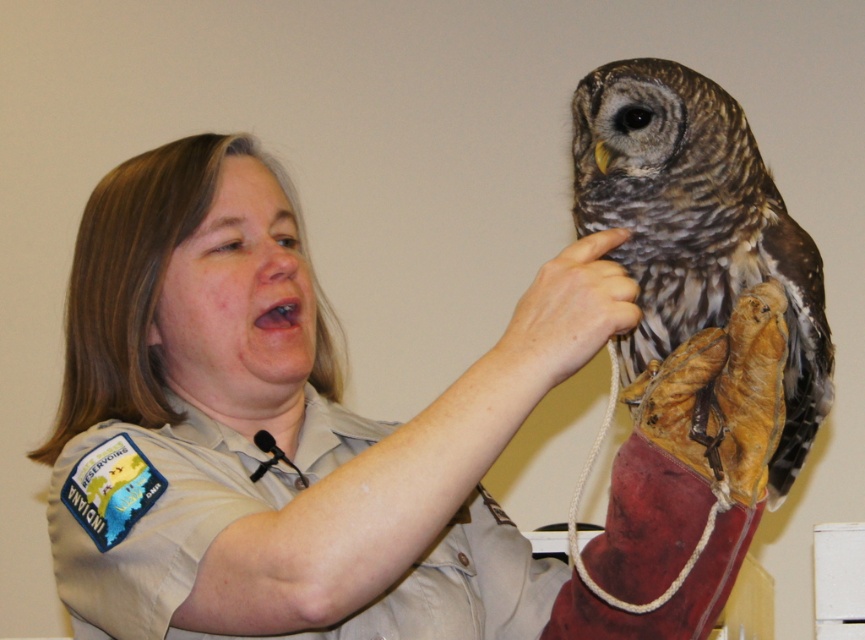
Does light brown uniform at center appear on the right side of brown speckled feathers at upper right?

Incorrect, light brown uniform at center is not on the right side of brown speckled feathers at upper right.

Between light brown uniform at center and brown speckled feathers at upper right, which one has more height?

light brown uniform at center

Is point (501, 420) more distant than point (575, 148)?

No, (501, 420) is in front of (575, 148).

Find the location of a particular element. Image resolution: width=865 pixels, height=640 pixels. light brown uniform at center is located at coordinates (361, 438).

Is point (827, 346) behind point (584, 291)?

Yes, point (827, 346) is farther from viewer.

Is brown speckled feathers at upper right taller than brown leather glove at upper center?

Yes, brown speckled feathers at upper right is taller than brown leather glove at upper center.

Does point (661, 288) come in front of point (561, 380)?

No, (661, 288) is further to viewer.

Identify the location of brown speckled feathers at upper right. The height and width of the screenshot is (640, 865). (697, 227).

Between point (312, 550) and point (582, 340), which one is positioned behind?

The point (582, 340) is behind.

The image size is (865, 640). What do you see at coordinates (361, 438) in the screenshot?
I see `light brown uniform at center` at bounding box center [361, 438].

Where is `light brown uniform at center`? Image resolution: width=865 pixels, height=640 pixels. light brown uniform at center is located at coordinates (361, 438).

Identify the location of light brown uniform at center. The image size is (865, 640). (361, 438).